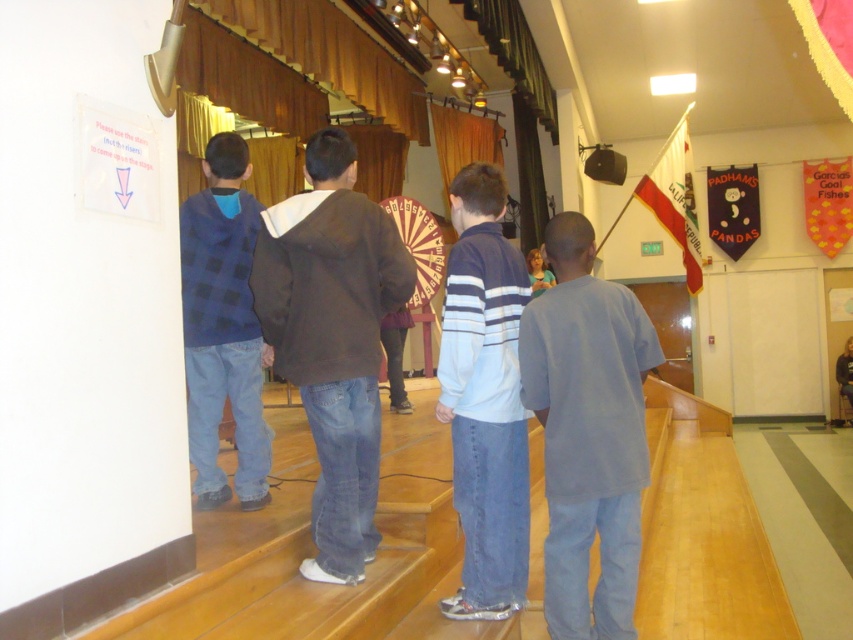
Question: Among these objects, which one is nearest to the camera?

Choices:
 (A) blue striped sweater at center
 (B) blue plaid shirt at left
 (C) gray cotton shirt at right

Answer: (C)

Question: Is gray cotton shirt at right to the right of blue plaid shirt at left from the viewer's perspective?

Choices:
 (A) no
 (B) yes

Answer: (B)

Question: Is gray cotton shirt at right wider than blue striped sweater at center?

Choices:
 (A) yes
 (B) no

Answer: (A)

Question: Which of the following is the closest to the observer?

Choices:
 (A) (567, 608)
 (B) (469, 424)
 (C) (204, 172)
 (D) (332, 221)

Answer: (A)

Question: Which point appears closest to the camera in this image?

Choices:
 (A) (234, 209)
 (B) (277, 321)
 (C) (567, 481)

Answer: (C)

Question: Is blue striped sweater at center in front of blue plaid shirt at left?

Choices:
 (A) yes
 (B) no

Answer: (A)